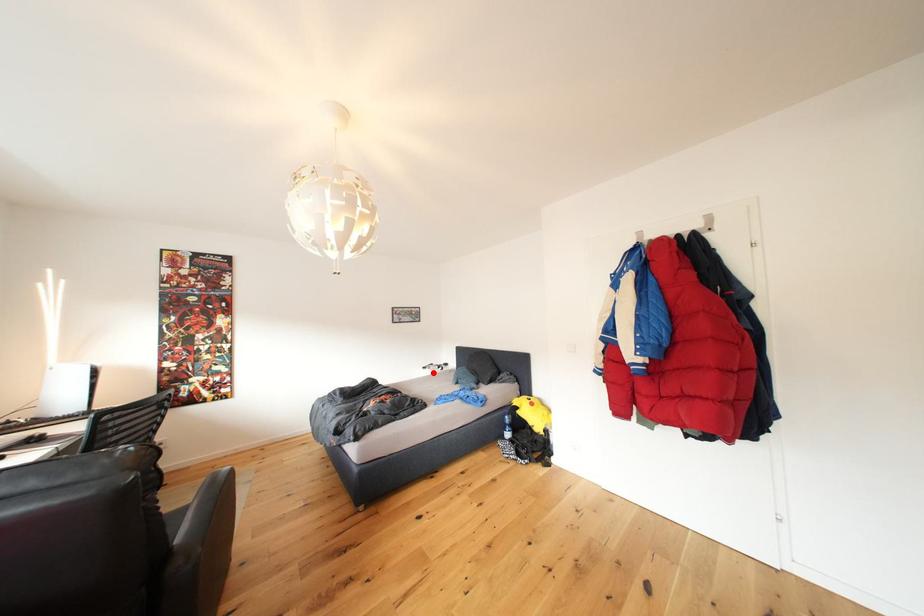
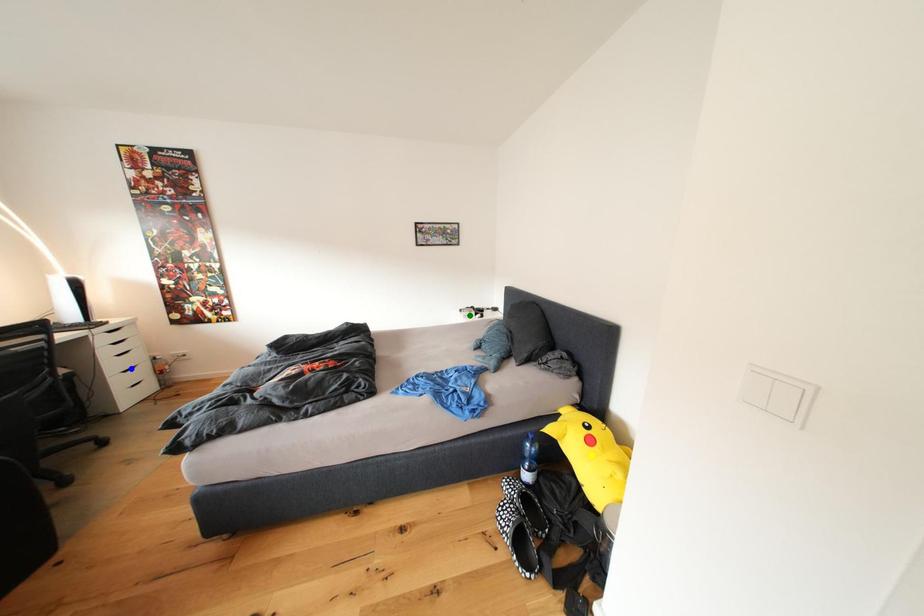
Question: I am providing you with two images of the same scene from different viewpoints. A red point is marked on the first image. You are given multiple points on the second image. Which mark in image 2 goes with the point in image 1?

Choices:
 (A) yellow point
 (B) blue point
 (C) green point

Answer: (C)